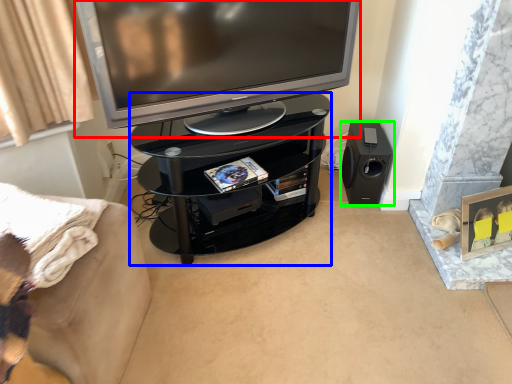
Question: Based on their relative distances, which object is farther from television (highlighted by a red box)? Choose from tv cabinet (highlighted by a blue box) and loudspeaker (highlighted by a green box).

Choices:
 (A) tv cabinet
 (B) loudspeaker

Answer: (B)